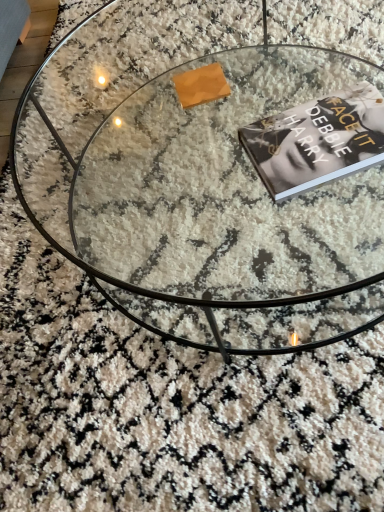
Image resolution: width=384 pixels, height=512 pixels. In order to click on vacant area in front of black matte book at center in this screenshot , I will do `click(349, 209)`.